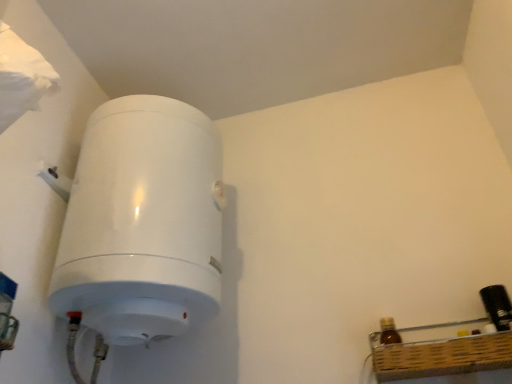
Question: Is the surface of brown glass bottle at lower right, which appears as the 1th bottle when viewed from the left, in direct contact with white glossy water heater at left?

Choices:
 (A) no
 (B) yes

Answer: (A)

Question: Is brown glass bottle at lower right, which appears as the 2th bottle when viewed from the right, aimed at white glossy water heater at left?

Choices:
 (A) yes
 (B) no

Answer: (B)

Question: Would you say brown glass bottle at lower right, which appears as the 2th bottle when viewed from the right, is outside white glossy water heater at left?

Choices:
 (A) no
 (B) yes

Answer: (B)

Question: Is brown glass bottle at lower right, which appears as the 2th bottle when viewed from the right, to the right of white glossy water heater at left from the viewer's perspective?

Choices:
 (A) yes
 (B) no

Answer: (A)

Question: Does brown glass bottle at lower right, which appears as the 1th bottle when viewed from the left, have a lesser height compared to white glossy water heater at left?

Choices:
 (A) no
 (B) yes

Answer: (B)

Question: In terms of width, does white glossy water heater at left look wider or thinner when compared to brown glass bottle at lower right, which appears as the 1th bottle when viewed from the left?

Choices:
 (A) wide
 (B) thin

Answer: (A)

Question: In the image, is white glossy water heater at left on the left side or the right side of brown glass bottle at lower right, which appears as the 2th bottle when viewed from the right?

Choices:
 (A) right
 (B) left

Answer: (B)

Question: Is point pyautogui.click(x=122, y=165) closer or farther from the camera than point pyautogui.click(x=397, y=342)?

Choices:
 (A) closer
 (B) farther

Answer: (B)

Question: From the image's perspective, is white glossy water heater at left above or below brown glass bottle at lower right, which appears as the 1th bottle when viewed from the left?

Choices:
 (A) above
 (B) below

Answer: (A)

Question: From their relative heights in the image, would you say brown glass bottle at lower right, which appears as the 2th bottle when viewed from the right, is taller or shorter than black plastic bottle at right, marked as the first bottle in a right-to-left arrangement?

Choices:
 (A) tall
 (B) short

Answer: (B)

Question: From the image's perspective, relative to black plastic bottle at right, marked as the first bottle in a right-to-left arrangement, is brown glass bottle at lower right, which appears as the 1th bottle when viewed from the left, above or below?

Choices:
 (A) below
 (B) above

Answer: (A)

Question: From a real-world perspective, is brown glass bottle at lower right, which appears as the 1th bottle when viewed from the left, positioned above or below black plastic bottle at right, the second bottle in the left-to-right sequence?

Choices:
 (A) above
 (B) below

Answer: (B)

Question: Which is correct: brown glass bottle at lower right, which appears as the 2th bottle when viewed from the right, is inside black plastic bottle at right, the second bottle in the left-to-right sequence, or outside of it?

Choices:
 (A) inside
 (B) outside

Answer: (B)

Question: Is white glossy water heater at left in front of or behind black plastic bottle at right, the second bottle in the left-to-right sequence, in the image?

Choices:
 (A) behind
 (B) front

Answer: (B)

Question: Do you think white glossy water heater at left is within black plastic bottle at right, marked as the first bottle in a right-to-left arrangement, or outside of it?

Choices:
 (A) outside
 (B) inside

Answer: (A)